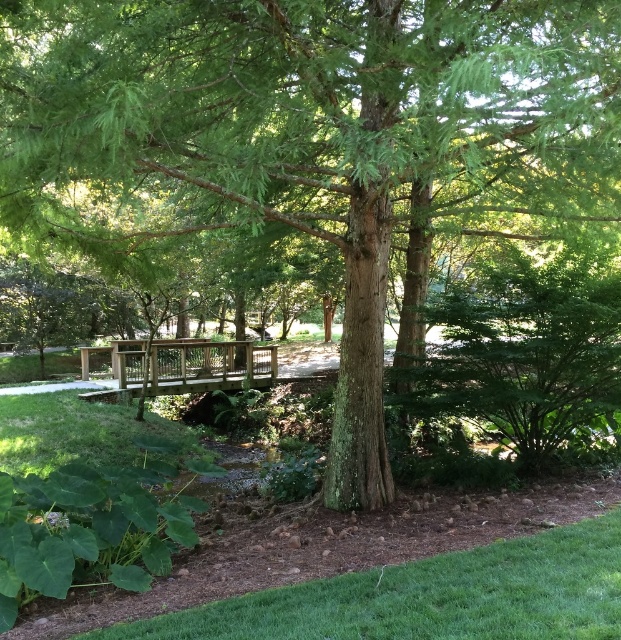
Is green grass at lower right shorter than wooden bridge at center?

Indeed, green grass at lower right has a lesser height compared to wooden bridge at center.

Can you confirm if green grass at lower right is positioned above wooden bridge at center?

No, green grass at lower right is not above wooden bridge at center.

Who is more distant from viewer, (88, 632) or (229, 353)?

The point (229, 353) is more distant.

The height and width of the screenshot is (640, 621). Find the location of `green grass at lower right`. green grass at lower right is located at coordinates (430, 596).